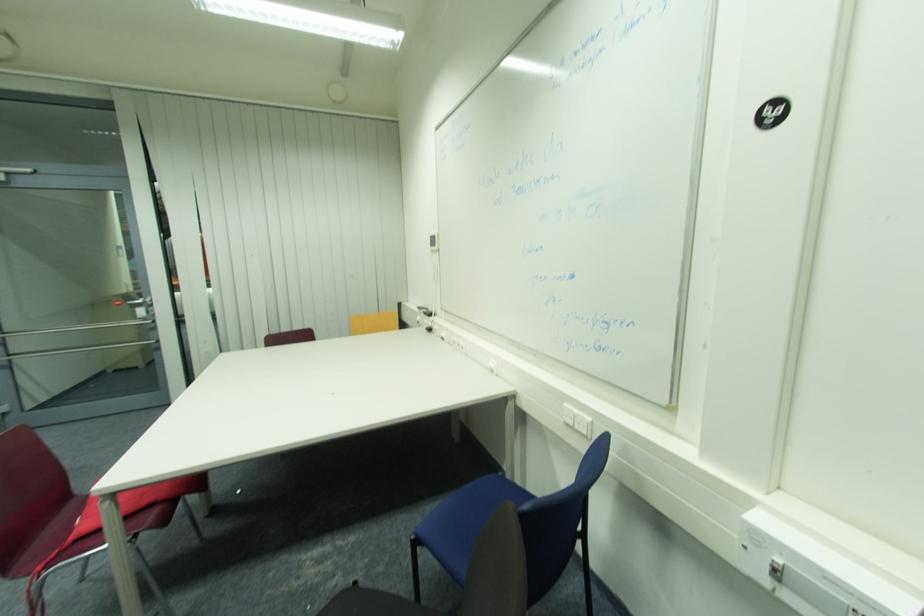
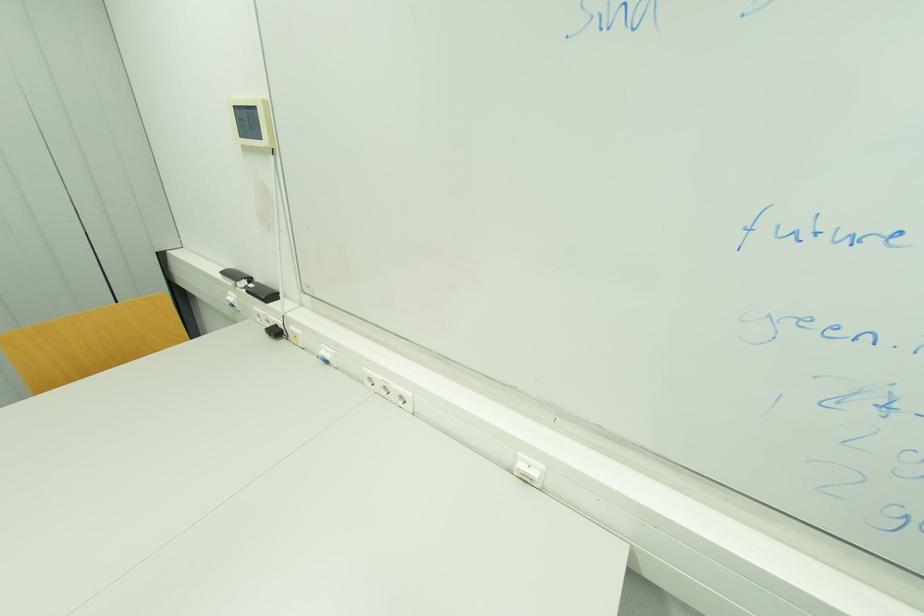
Where in the second image is the point corresponding to point 433,331 from the first image?

(281, 333)